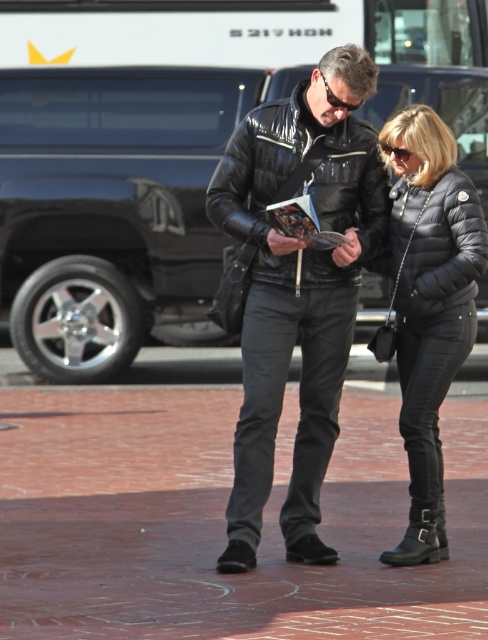
Question: Is brick pavement at center thinner than black leather jacket at center?

Choices:
 (A) no
 (B) yes

Answer: (A)

Question: Among these objects, which one is farthest from the camera?

Choices:
 (A) black leather jacket at center
 (B) glossy black jacket at center

Answer: (B)

Question: Can you confirm if glossy black jacket at center is positioned to the right of black puffer jacket at right?

Choices:
 (A) no
 (B) yes

Answer: (A)

Question: Which object appears closest to the camera in this image?

Choices:
 (A) black leather jacket at center
 (B) brick pavement at center
 (C) black quilted jacket at center

Answer: (B)

Question: Which object appears closest to the camera in this image?

Choices:
 (A) black quilted jacket at center
 (B) black leather jacket at center
 (C) glossy black jacket at center

Answer: (B)

Question: Is the position of black leather jacket at center more distant than that of black puffer jacket at right?

Choices:
 (A) yes
 (B) no

Answer: (B)